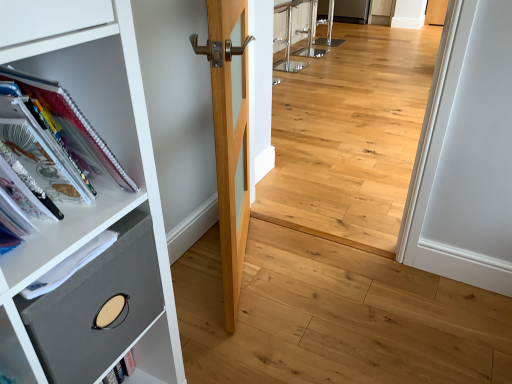
I want to click on light wood door at center, so click(x=230, y=137).

The height and width of the screenshot is (384, 512). I want to click on spiral-bound paper at left, so click(70, 131).

What do you see at coordinates (350, 136) in the screenshot?
I see `natural wood floor at center` at bounding box center [350, 136].

Locate an element on the screen. gray fabric drawer at left is located at coordinates (97, 306).

Is gray fabric drawer at left positioned behind natural wood floor at center?

No, gray fabric drawer at left is closer to the viewer.

Is gray fabric drawer at left wider than natural wood floor at center?

Correct, the width of gray fabric drawer at left exceeds that of natural wood floor at center.

Identify the location of corridor lying on the right of gray fabric drawer at left. (350, 136).

Is gray fabric drawer at left facing away from natural wood floor at center?

No, gray fabric drawer at left's orientation is not away from natural wood floor at center.

Is spiral-bound paper at left thinner than light wood door at center?

No, spiral-bound paper at left is not thinner than light wood door at center.

How far apart are spiral-bound paper at left and light wood door at center?

The distance of spiral-bound paper at left from light wood door at center is 49.84 centimeters.

Could light wood door at center be considered to be inside spiral-bound paper at left?

No, light wood door at center is not inside spiral-bound paper at left.

From the picture: Considering the sizes of objects spiral-bound paper at left and light wood door at center in the image provided, who is bigger, spiral-bound paper at left or light wood door at center?

light wood door at center is bigger.

Can natural wood floor at center be found inside spiral-bound paper at left?

Definitely not — natural wood floor at center is not inside spiral-bound paper at left.

Is spiral-bound paper at left positioned before natural wood floor at center?

Yes, spiral-bound paper at left is closer to the camera.

Considering the sizes of objects spiral-bound paper at left and natural wood floor at center in the image provided, who is thinner, spiral-bound paper at left or natural wood floor at center?

With smaller width is natural wood floor at center.

From the image's perspective, is spiral-bound paper at left over natural wood floor at center?

No.

Is gray fabric drawer at left inside light wood door at center?

No, gray fabric drawer at left is not surrounded by light wood door at center.

Which object is further away from the camera, light wood door at center or gray fabric drawer at left?

light wood door at center is more distant.

From the image's perspective, is light wood door at center located above gray fabric drawer at left?

Yes.

Looking at this image, does light wood door at center have a greater width compared to gray fabric drawer at left?

In fact, light wood door at center might be narrower than gray fabric drawer at left.

Is natural wood floor at center looking in the opposite direction of light wood door at center?

Yes, natural wood floor at center's orientation is away from light wood door at center.

Considering the sizes of natural wood floor at center and light wood door at center in the image, is natural wood floor at center taller or shorter than light wood door at center?

Considering their sizes, natural wood floor at center has less height than light wood door at center.

Considering the sizes of natural wood floor at center and light wood door at center in the image, is natural wood floor at center bigger or smaller than light wood door at center?

Considering their sizes, natural wood floor at center takes up less space than light wood door at center.

Is natural wood floor at center beside light wood door at center?

No, natural wood floor at center is not next to light wood door at center.

From the image's perspective, between spiral-bound paper at left and gray fabric drawer at left, which one is located above?

spiral-bound paper at left, from the image's perspective.

This screenshot has width=512, height=384. In order to click on drawer that is behind the spiral-bound paper at left in this screenshot , I will do `click(97, 306)`.

Are spiral-bound paper at left and gray fabric drawer at left far apart?

No.

From a real-world perspective, is spiral-bound paper at left physically located above or below gray fabric drawer at left?

In terms of real-world spatial position, spiral-bound paper at left is above gray fabric drawer at left.

How much distance is there between gray fabric drawer at left and light wood door at center?

gray fabric drawer at left and light wood door at center are 20.90 inches apart from each other.

Considering the sizes of objects gray fabric drawer at left and light wood door at center in the image provided, who is smaller, gray fabric drawer at left or light wood door at center?

With smaller size is gray fabric drawer at left.

Are gray fabric drawer at left and light wood door at center making contact?

No, gray fabric drawer at left is not making contact with light wood door at center.

Is gray fabric drawer at left positioned before light wood door at center?

Yes.

The image size is (512, 384). Identify the location of drawer in front of the natural wood floor at center. pos(97,306).

The height and width of the screenshot is (384, 512). Find the location of `door on the right of spiral-bound paper at left`. door on the right of spiral-bound paper at left is located at coordinates (230, 137).

Considering their positions, is gray fabric drawer at left positioned closer to light wood door at center than natural wood floor at center?

gray fabric drawer at left.

From the image, which object appears to be farther from spiral-bound paper at left, light wood door at center or gray fabric drawer at left?

Among the two, light wood door at center is located further to spiral-bound paper at left.

When comparing their distances from natural wood floor at center, does light wood door at center or gray fabric drawer at left seem further?

gray fabric drawer at left is positioned further to the anchor natural wood floor at center.

Which object lies nearer to the anchor point spiral-bound paper at left, light wood door at center or natural wood floor at center?

Among the two, light wood door at center is located nearer to spiral-bound paper at left.

From the image, which object appears to be nearer to spiral-bound paper at left, natural wood floor at center or light wood door at center?

light wood door at center is positioned closer to the anchor spiral-bound paper at left.

Looking at this image, based on their spatial positions, is spiral-bound paper at left or natural wood floor at center further from gray fabric drawer at left?

Among the two, natural wood floor at center is located further to gray fabric drawer at left.

Looking at this image, looking at the image, which one is located closer to light wood door at center, spiral-bound paper at left or natural wood floor at center?

spiral-bound paper at left lies closer to light wood door at center than the other object.

Looking at the image, which one is located closer to light wood door at center, spiral-bound paper at left or gray fabric drawer at left?

spiral-bound paper at left lies closer to light wood door at center than the other object.

Identify the location of book between gray fabric drawer at left and natural wood floor at center from left to right. The height and width of the screenshot is (384, 512). (70, 131).

In order to click on door positioned between spiral-bound paper at left and natural wood floor at center from near to far in this screenshot , I will do `click(230, 137)`.

This screenshot has height=384, width=512. Identify the location of door between gray fabric drawer at left and natural wood floor at center in the horizontal direction. (230, 137).

Identify the location of book between gray fabric drawer at left and light wood door at center. Image resolution: width=512 pixels, height=384 pixels. (70, 131).